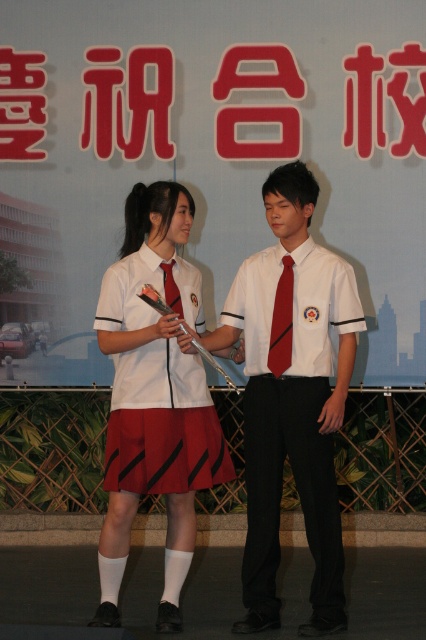
You are a photographer standing at the camera position. You want to place a new sign that is exactly 6 meters away from the camera between the red plastic sign at upper center and the banner. Is this possible?

The red plastic sign at upper center is 7.13 meters from the camera. Since the new sign needs to be placed at 6 meters, which is closer than the existing sign, there is space between the camera and the red plastic sign at upper center to place the new sign. Therefore, it is possible to position the new sign 6 meters from the camera between them.

You are a photographer positioned at the front of the stage. You want to focus your camera on the red satin tie at center. What are the coordinates where you should aim your camera?

The coordinates to aim your camera are at point (282, 321).